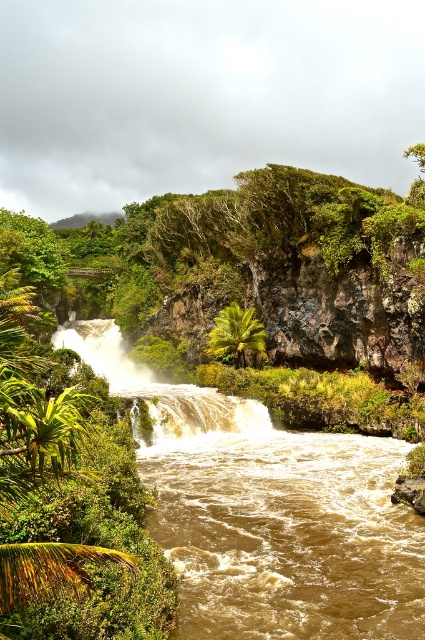
Can you confirm if brown textured waterfall at center is thinner than green leafy palm tree at center?

No.

Does brown textured waterfall at center have a larger size compared to green leafy palm tree at center?

Indeed, brown textured waterfall at center has a larger size compared to green leafy palm tree at center.

Which is in front, point (184, 429) or point (235, 353)?

Positioned in front is point (184, 429).

Locate an element on the screen. This screenshot has height=640, width=425. brown textured waterfall at center is located at coordinates (161, 387).